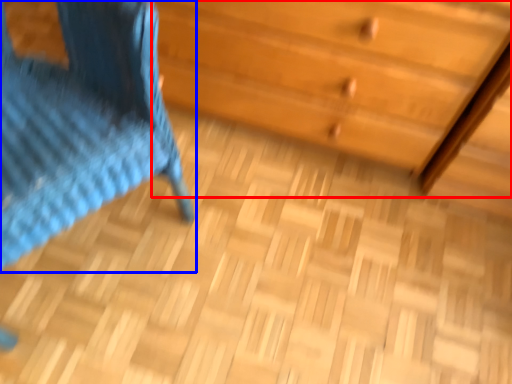
Question: Which point is further to the camera, chest of drawers (highlighted by a red box) or furniture (highlighted by a blue box)?

Choices:
 (A) chest of drawers
 (B) furniture

Answer: (A)